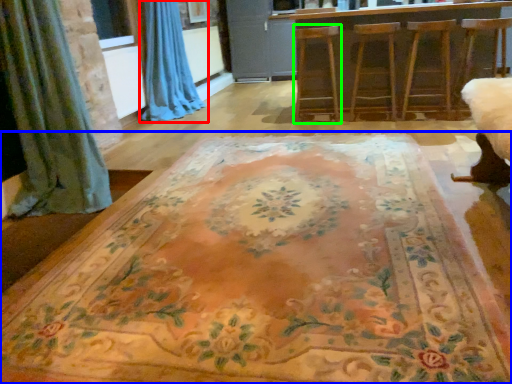
Question: Based on their relative distances, which object is nearer to curtain (highlighted by a red box)? Choose from furniture (highlighted by a blue box) and armchair (highlighted by a green box).

Choices:
 (A) furniture
 (B) armchair

Answer: (B)